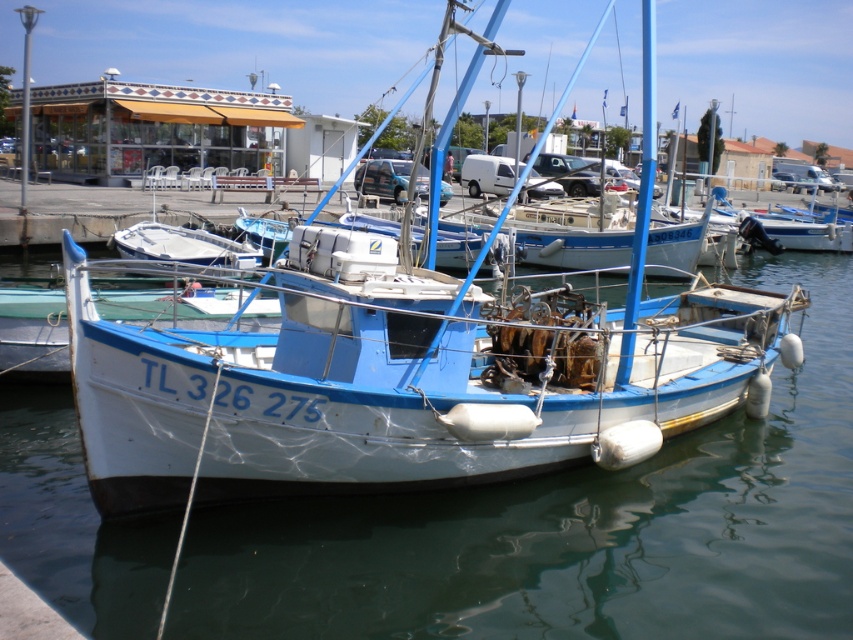
You are standing at the edge of the marina and want to walk to the fishing boat with registration number TL 326 275. There are two points marked on your map as point A at coordinates point A is point (723,538) and point B is point (497,394). Which point should you head towards first to reach the boat?

You should head towards point A at coordinates point (723,538) first because it is in front of point B at coordinates point (497,394), meaning it is closer to your current position at the edge of the marina.